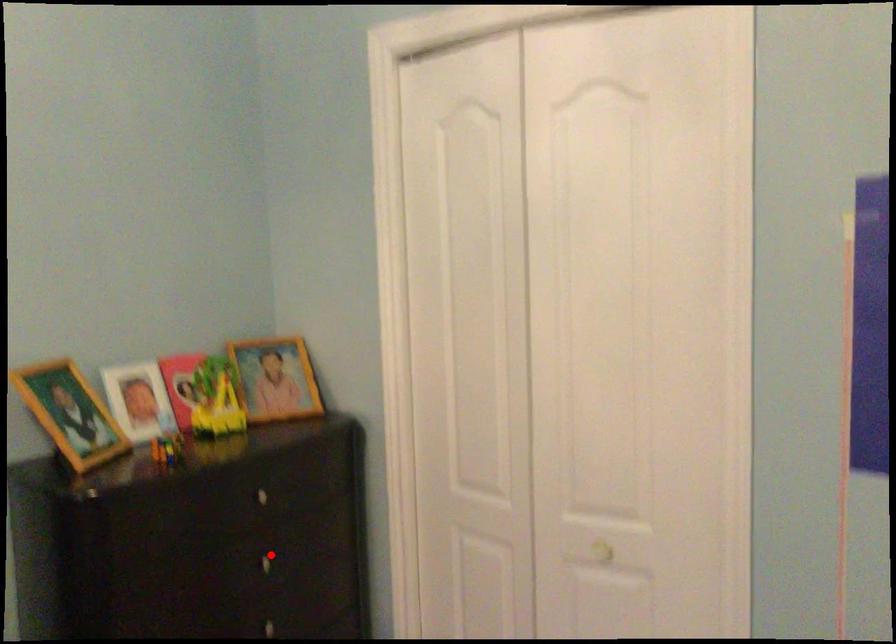
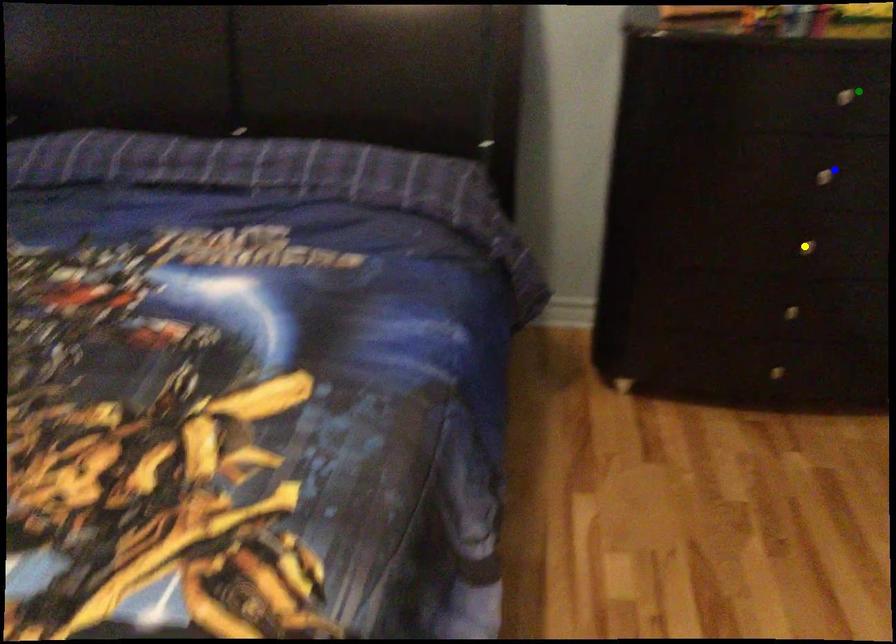
Question: I am providing you with two images of the same scene from different viewpoints. A red point is marked on the first image. You are given multiple points on the second image. Which point in image 2 is actually the same real-world point as the red point in image 1?

Choices:
 (A) green point
 (B) blue point
 (C) yellow point

Answer: (B)